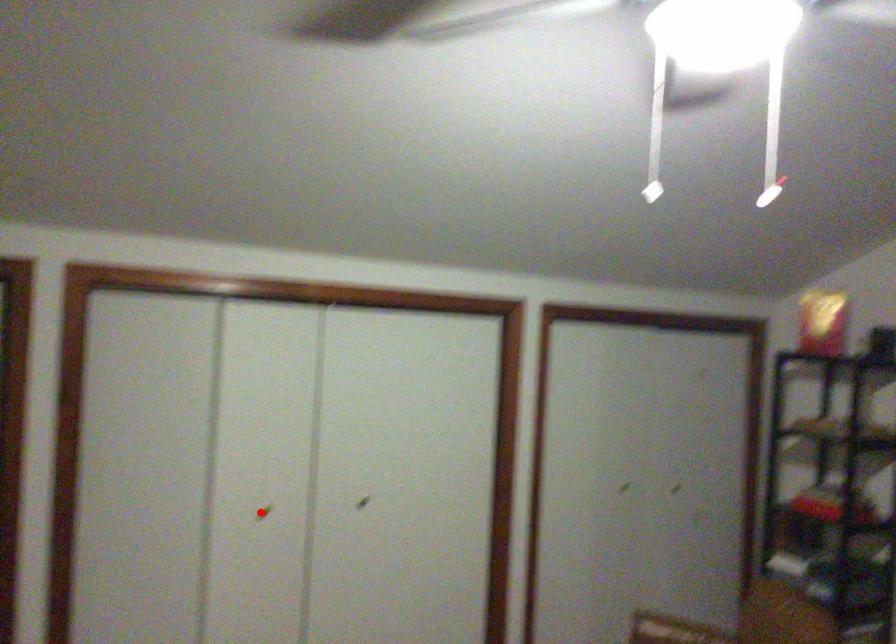
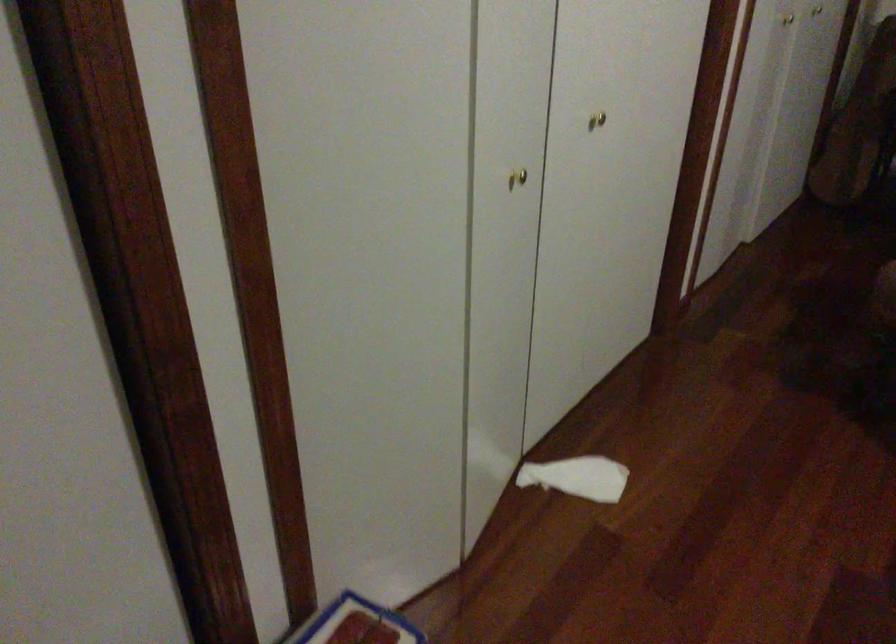
Question: I am providing you with two images of the same scene from different viewpoints. Given a red point in image1, look at the same physical point in image2. Is it:

Choices:
 (A) Closer to the viewpoint
 (B) Farther from the viewpoint

Answer: (A)